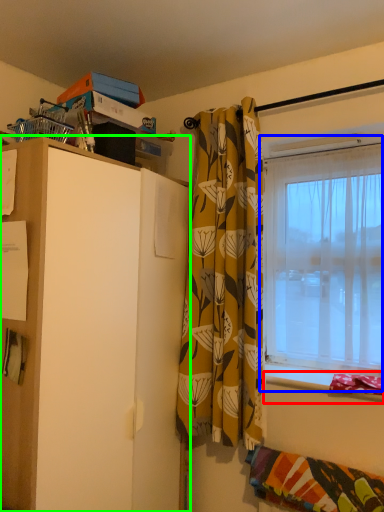
Question: Considering the real-world distances, which object is closest to window sill (highlighted by a red box)? window (highlighted by a blue box) or cabinetry (highlighted by a green box).

Choices:
 (A) window
 (B) cabinetry

Answer: (A)